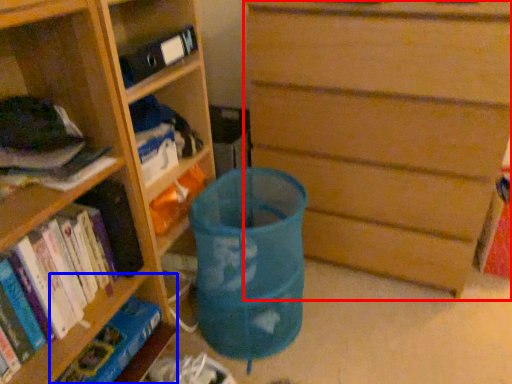
Question: Among these objects, which one is farthest to the camera, chest of drawers (highlighted by a red box) or shelf (highlighted by a blue box)?

Choices:
 (A) chest of drawers
 (B) shelf

Answer: (B)